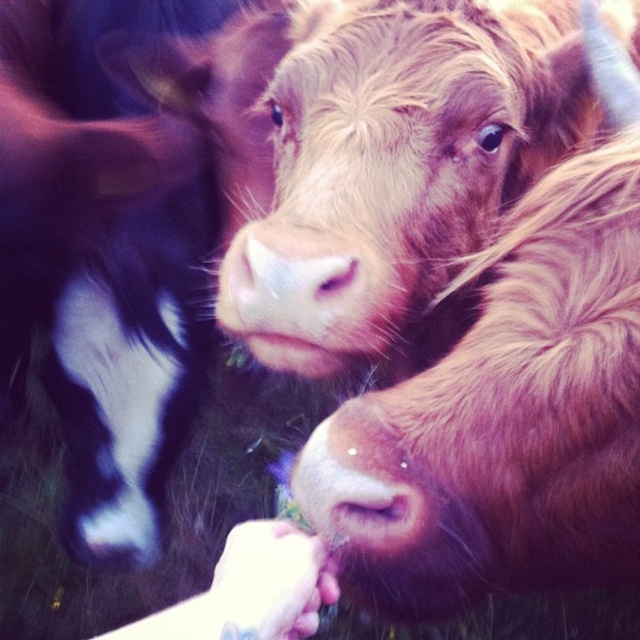
Question: Does brown furry cow at center have a larger size compared to pink soft fur nose at center?

Choices:
 (A) yes
 (B) no

Answer: (A)

Question: Is black and white fur at left positioned in front of pink soft fur nose at center?

Choices:
 (A) yes
 (B) no

Answer: (B)

Question: Is brown furry cow at center in front of pink soft fur nose at center?

Choices:
 (A) yes
 (B) no

Answer: (B)

Question: Which of these objects is positioned farthest from the brown furry cow at center?

Choices:
 (A) pink soft fur nose at center
 (B) black and white fur at left

Answer: (B)

Question: Estimate the real-world distances between objects in this image. Which object is closer to the pink soft fur nose at center?

Choices:
 (A) brown furry cow at center
 (B) black and white fur at left

Answer: (A)

Question: Which object is farther from the camera taking this photo?

Choices:
 (A) brown furry cow at center
 (B) pink soft fur nose at center
 (C) black and white fur at left

Answer: (C)